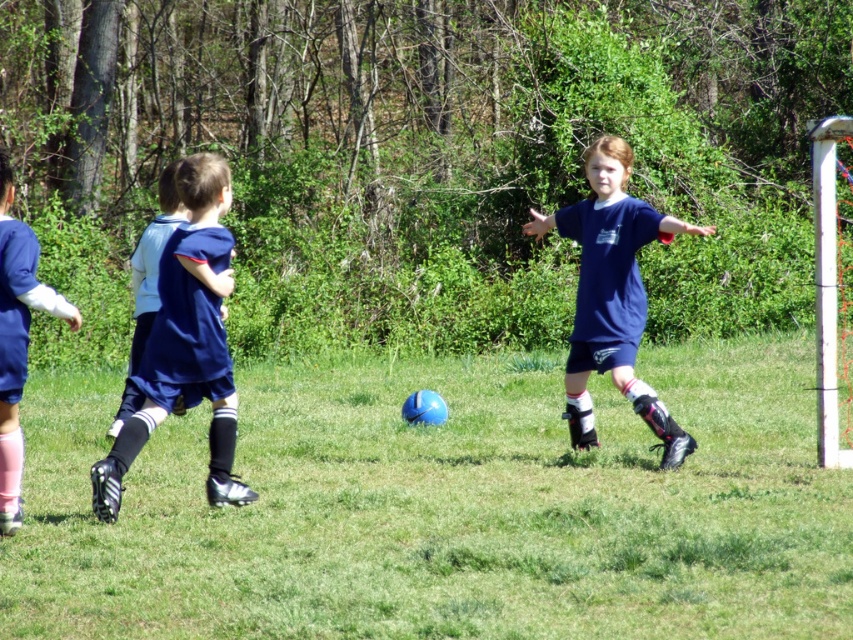
Question: Is blue jersey at left to the left of blue fabric shorts at left from the viewer's perspective?

Choices:
 (A) no
 (B) yes

Answer: (B)

Question: In this image, where is dark blue jersey at center located relative to blue jersey at left?

Choices:
 (A) right
 (B) left

Answer: (A)

Question: Does dark blue jersey at center appear under blue jersey at left?

Choices:
 (A) yes
 (B) no

Answer: (B)

Question: Which object is closer to the camera taking this photo?

Choices:
 (A) dark blue jersey at center
 (B) blue jersey at left
 (C) green grass at center
 (D) blue fabric shorts at left

Answer: (C)

Question: Estimate the real-world distances between objects in this image. Which object is farther from the green grass at center?

Choices:
 (A) dark blue jersey at center
 (B) matte blue shirt at center
 (C) blue fabric shorts at left
 (D) blue jersey at left

Answer: (D)

Question: Among these points, which one is nearest to the camera?

Choices:
 (A) (523, 410)
 (B) (584, 310)

Answer: (B)